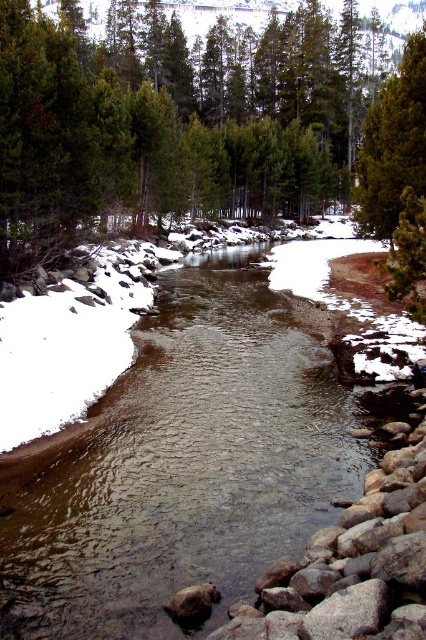
You are standing at the edge of the river and want to walk towards the green matte tree at upper center. However, you notice another green matte tree at center blocking your path. Which tree should you go around to reach your destination?

You should go around the green matte tree at center because it is closer to you and blocking the path to the green matte tree at upper center.

You are standing at the edge of the river and want to reach the green matte tree at center. Which direction should you head towards relative to the river?

The green matte tree at center is located at point (x=169, y=120), so you should head towards the center of the river from your current position at the edge.